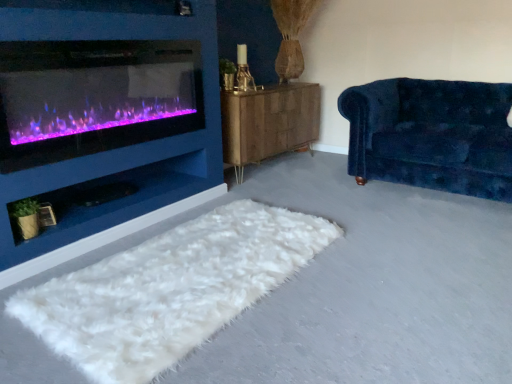
I want to click on purple glass wood burning stove at left, so click(x=94, y=97).

Find the location of a particular element. The width and height of the screenshot is (512, 384). white fluffy rug at lower center is located at coordinates (169, 289).

Find the location of a particular element. woodenmaterial/texturedresser at center is located at coordinates (269, 123).

Can you confirm if purple glass wood burning stove at left is positioned to the left of velvet blue couch at right?

Correct, you'll find purple glass wood burning stove at left to the left of velvet blue couch at right.

Do you think purple glass wood burning stove at left is within velvet blue couch at right, or outside of it?

purple glass wood burning stove at left cannot be found inside velvet blue couch at right.

From the image's perspective, is purple glass wood burning stove at left below velvet blue couch at right?

No, from the image's perspective, purple glass wood burning stove at left is not below velvet blue couch at right.

Looking at their sizes, would you say purple glass wood burning stove at left is wider or thinner than velvet blue couch at right?

Clearly, purple glass wood burning stove at left has less width compared to velvet blue couch at right.

How far apart are purple glass wood burning stove at left and woodenmaterial/texturedresser at center?

A distance of 37.11 inches exists between purple glass wood burning stove at left and woodenmaterial/texturedresser at center.

Considering the sizes of objects purple glass wood burning stove at left and woodenmaterial/texturedresser at center in the image provided, who is thinner, purple glass wood burning stove at left or woodenmaterial/texturedresser at center?

Thinner between the two is purple glass wood burning stove at left.

Can you confirm if purple glass wood burning stove at left is smaller than woodenmaterial/texturedresser at center?

Correct, purple glass wood burning stove at left occupies less space than woodenmaterial/texturedresser at center.

Does point (33, 145) lie behind point (267, 102)?

No, (33, 145) is closer to viewer.

Find the location of a particular element. The image size is (512, 384). studio couch that is behind the white fluffy rug at lower center is located at coordinates (432, 135).

Is white fluffy rug at lower center turned away from velvet blue couch at right?

No, white fluffy rug at lower center is not facing the opposite direction of velvet blue couch at right.

From a real-world perspective, which is physically below, white fluffy rug at lower center or velvet blue couch at right?

In real-world perspective, white fluffy rug at lower center is lower.

How distant is white fluffy rug at lower center from velvet blue couch at right?

A distance of 4.70 feet exists between white fluffy rug at lower center and velvet blue couch at right.

From the picture: Considering the relative positions of white fluffy rug at lower center and purple glass wood burning stove at left in the image provided, is white fluffy rug at lower center behind purple glass wood burning stove at left?

No, white fluffy rug at lower center is closer to the viewer.

From a real-world perspective, is white fluffy rug at lower center located higher than purple glass wood burning stove at left?

No, from a real-world perspective, white fluffy rug at lower center is not above purple glass wood burning stove at left.

Is point (173, 253) more distant than point (81, 103)?

No.

Where is `wood burning stove above the white fluffy rug at lower center (from the image's perspective)`? The width and height of the screenshot is (512, 384). wood burning stove above the white fluffy rug at lower center (from the image's perspective) is located at coordinates (94, 97).

Can you tell me how much woodenmaterial/texturedresser at center and purple glass wood burning stove at left differ in facing direction?

0.0337 degrees separate the facing orientations of woodenmaterial/texturedresser at center and purple glass wood burning stove at left.

Can you confirm if woodenmaterial/texturedresser at center is positioned to the right of purple glass wood burning stove at left?

Yes.

Is the depth of woodenmaterial/texturedresser at center less than that of purple glass wood burning stove at left?

No, woodenmaterial/texturedresser at center is further to the viewer.

The width and height of the screenshot is (512, 384). What are the coordinates of `mat located in front of the velvet blue couch at right` in the screenshot? It's located at (169, 289).

Consider the image. Looking at their sizes, would you say velvet blue couch at right is wider or thinner than white fluffy rug at lower center?

velvet blue couch at right is wider than white fluffy rug at lower center.

From the image's perspective, would you say velvet blue couch at right is positioned over white fluffy rug at lower center?

Yes, from the image's perspective, velvet blue couch at right is above white fluffy rug at lower center.

In the scene shown: Which object is further away from the camera taking this photo, velvet blue couch at right or white fluffy rug at lower center?

velvet blue couch at right is more distant.

This screenshot has height=384, width=512. Find the location of `mat below the purple glass wood burning stove at left (from a real-world perspective)`. mat below the purple glass wood burning stove at left (from a real-world perspective) is located at coordinates (169, 289).

From a real-world perspective, which object stands above the other?

purple glass wood burning stove at left, from a real-world perspective.

Could you tell me if purple glass wood burning stove at left is facing white fluffy rug at lower center?

No.

Which of these two, purple glass wood burning stove at left or white fluffy rug at lower center, is smaller?

With smaller size is purple glass wood burning stove at left.

Image resolution: width=512 pixels, height=384 pixels. I want to click on wood burning stove located in front of the velvet blue couch at right, so click(94, 97).

Where is `dresser located above the purple glass wood burning stove at left (from the image's perspective)`? dresser located above the purple glass wood burning stove at left (from the image's perspective) is located at coordinates (x=269, y=123).

Based on the photo, looking at the image, which one is located closer to woodenmaterial/texturedresser at center, velvet blue couch at right or white fluffy rug at lower center?

velvet blue couch at right.

When comparing their distances from purple glass wood burning stove at left, does velvet blue couch at right or woodenmaterial/texturedresser at center seem further?

velvet blue couch at right.

From the image, which object appears to be farther from purple glass wood burning stove at left, white fluffy rug at lower center or woodenmaterial/texturedresser at center?

Among the two, woodenmaterial/texturedresser at center is located further to purple glass wood burning stove at left.

Based on their spatial positions, is white fluffy rug at lower center or woodenmaterial/texturedresser at center closer to velvet blue couch at right?

Based on the image, woodenmaterial/texturedresser at center appears to be nearer to velvet blue couch at right.

Based on their spatial positions, is velvet blue couch at right or purple glass wood burning stove at left closer to white fluffy rug at lower center?

purple glass wood burning stove at left is positioned closer to the anchor white fluffy rug at lower center.

Based on their spatial positions, is velvet blue couch at right or white fluffy rug at lower center closer to purple glass wood burning stove at left?

white fluffy rug at lower center is positioned closer to the anchor purple glass wood burning stove at left.

Considering their positions, is velvet blue couch at right positioned further to white fluffy rug at lower center than woodenmaterial/texturedresser at center?

velvet blue couch at right lies further to white fluffy rug at lower center than the other object.

Which object lies further to the anchor point woodenmaterial/texturedresser at center, white fluffy rug at lower center or purple glass wood burning stove at left?

Among the two, white fluffy rug at lower center is located further to woodenmaterial/texturedresser at center.

At what (x,y) coordinates should I click in order to perform the action: click on wood burning stove positioned between white fluffy rug at lower center and woodenmaterial/texturedresser at center from near to far. Please return your answer as a coordinate pair (x, y). Looking at the image, I should click on (94, 97).

Image resolution: width=512 pixels, height=384 pixels. I want to click on dresser between purple glass wood burning stove at left and velvet blue couch at right in the horizontal direction, so click(269, 123).

At what (x,y) coordinates should I click in order to perform the action: click on mat situated between purple glass wood burning stove at left and velvet blue couch at right from left to right. Please return your answer as a coordinate pair (x, y). The height and width of the screenshot is (384, 512). Looking at the image, I should click on (169, 289).

Where is `studio couch between white fluffy rug at lower center and woodenmaterial/texturedresser at center in the front-back direction`? Image resolution: width=512 pixels, height=384 pixels. studio couch between white fluffy rug at lower center and woodenmaterial/texturedresser at center in the front-back direction is located at coordinates pos(432,135).